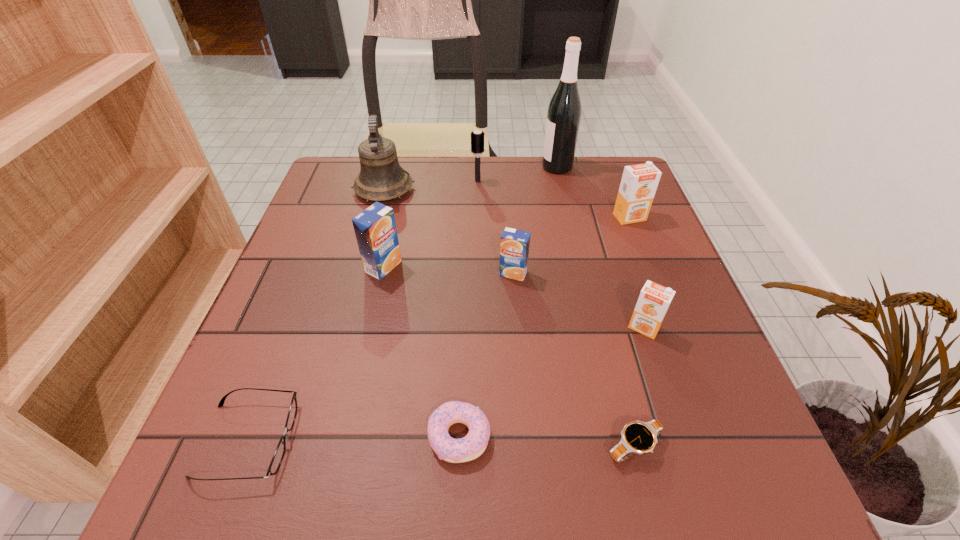
Where is `vacant region located 0.090m on the left of the farther orange orange juice`? The image size is (960, 540). vacant region located 0.090m on the left of the farther orange orange juice is located at coordinates tap(578, 217).

Locate an element on the screen. The image size is (960, 540). free space located on the front of the left blue orange_juice is located at coordinates (338, 471).

This screenshot has height=540, width=960. I want to click on blank area located 0.270m on the right of the fifth object from right to left, so click(652, 273).

Locate an element on the screen. vacant space located 0.180m on the back of the smaller orange orange juice is located at coordinates (619, 255).

I want to click on vacant space located on the front of the pink doughnut, so click(457, 503).

At what (x,y) coordinates should I click in order to perform the action: click on free space located on the front-facing side of the spectacles. Please return your answer as a coordinate pair (x, y). The width and height of the screenshot is (960, 540). Looking at the image, I should click on (522, 440).

Where is `vacant space located 0.170m on the left of the watch`? The height and width of the screenshot is (540, 960). vacant space located 0.170m on the left of the watch is located at coordinates (494, 447).

Identify the location of wine bottle present at the far edge. Image resolution: width=960 pixels, height=540 pixels. (564, 112).

The image size is (960, 540). In order to click on bell positioned at the far edge in this screenshot , I will do `click(381, 178)`.

In order to click on hairbrush at the far edge in this screenshot , I will do `click(477, 137)`.